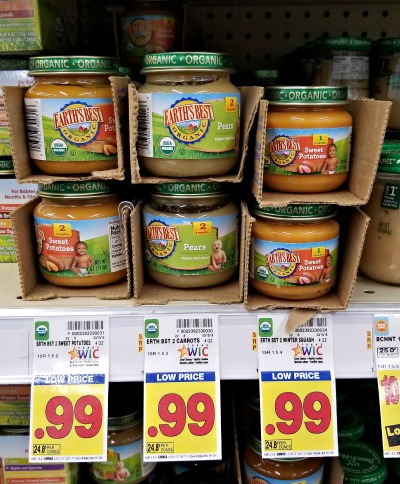
The height and width of the screenshot is (484, 400). Find the location of `cardboard dividers`. cardboard dividers is located at coordinates (118, 288), (210, 294), (262, 301), (280, 198), (234, 174), (113, 170), (238, 460).